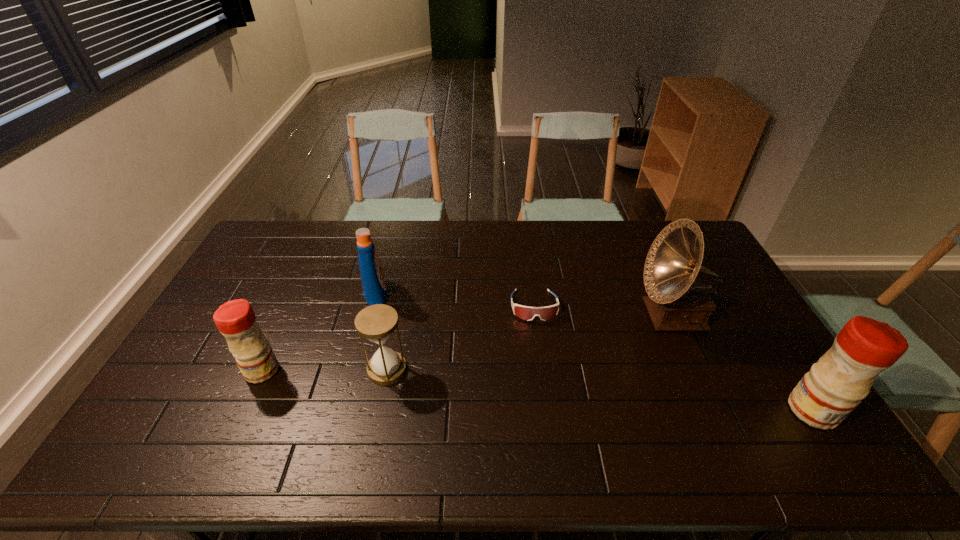
You are a GUI agent. You are given a task and a screenshot of the screen. Output one action in this format:
    pyautogui.click(x=<x>, y=<y>)
    Task: Click on the object that is at the near right corner
    Image resolution: width=960 pixels, height=540 pixels.
    Given the screenshot: What is the action you would take?
    pyautogui.click(x=835, y=385)

At what (x,y) coordinates should I click in order to perform the action: click on vacant space at the far edge of the desktop. Please return your answer as a coordinate pair (x, y). The height and width of the screenshot is (540, 960). Looking at the image, I should click on (396, 222).

Find the location of a particular element. The width and height of the screenshot is (960, 540). free space at the near edge of the desktop is located at coordinates (536, 410).

Identify the location of vacant area at the far left corner. The width and height of the screenshot is (960, 540). (266, 230).

What are the coordinates of `free area in between the taller condiment and the goggles` in the screenshot? It's located at click(674, 359).

Find the location of `empty space that is in between the goggles and the left condiment`. empty space that is in between the goggles and the left condiment is located at coordinates (397, 339).

Locate an element on the screen. The width and height of the screenshot is (960, 540). vacant area between the shortest object and the left condiment is located at coordinates (397, 339).

Find the location of a particular element. free space between the fifth object from left to right and the rightmost object is located at coordinates (743, 363).

You are a GUI agent. You are given a task and a screenshot of the screen. Output one action in this format:
    pyautogui.click(x=<x>, y=<y>)
    Task: Click on the free space between the detergent and the second object from right to left
    This screenshot has height=540, width=960.
    Given the screenshot: What is the action you would take?
    524,304

In order to click on free spot between the right condiment and the leftmost object in this screenshot , I will do `click(538, 390)`.